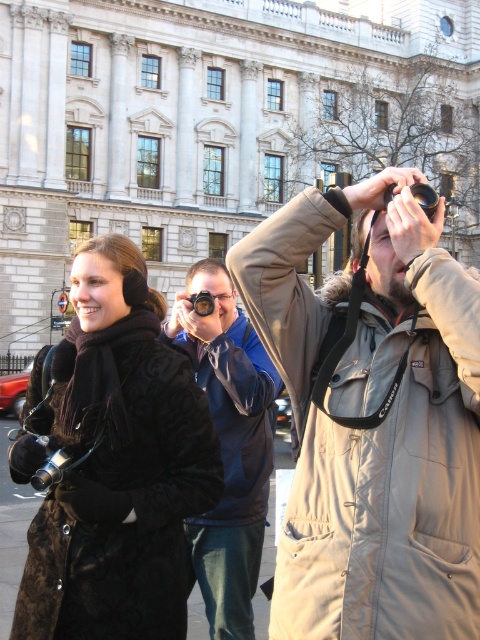
You are a photographer trying to capture a photo of the two people in the scene. The tan fabric coat at upper right and the black fur coat at center are both in your viewfinder. Which coat should you focus on if you want to include both in the frame without moving the camera?

You should focus on the black fur coat at center because the tan fabric coat at upper right is located above it, allowing both to be in the frame by centering on the lower coat.

What is the exact location of the tan fabric coat at upper right in the image?

The tan fabric coat at upper right is located at point [375,426].